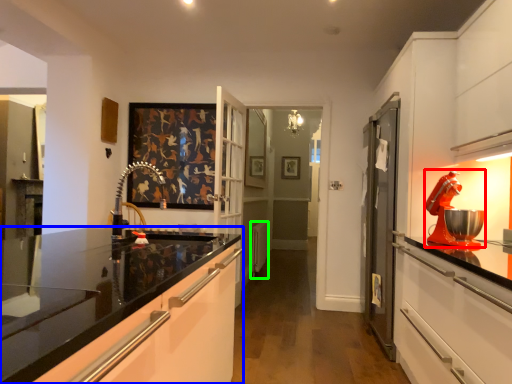
Question: Which object is the closest to the home appliance (highlighted by a red box)? Choose among these: cabinetry (highlighted by a blue box) or appliance (highlighted by a green box).

Choices:
 (A) cabinetry
 (B) appliance

Answer: (A)